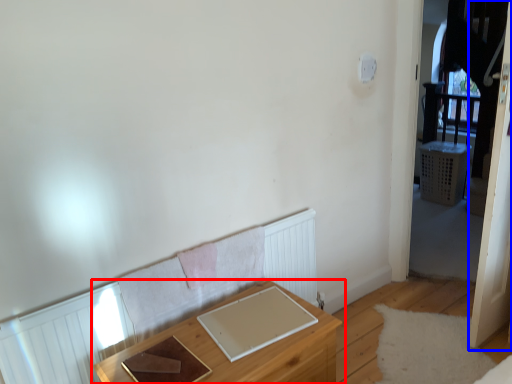
Question: Which object is further to the camera taking this photo, table (highlighted by a red box) or screen door (highlighted by a blue box)?

Choices:
 (A) table
 (B) screen door

Answer: (B)